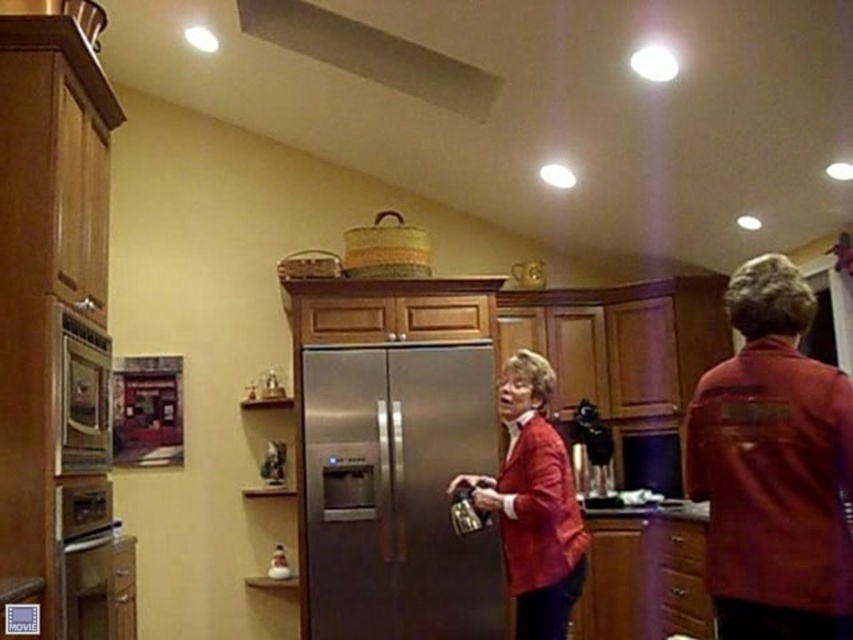
Question: Which is nearer to the matte red blazer at center?

Choices:
 (A) stainless steel oven at left
 (B) matte red jacket at center
 (C) stainless steel refrigerator at center

Answer: (B)

Question: Which of the following is the closest to the observer?

Choices:
 (A) white matte exhaust hood at upper center
 (B) matte red jacket at center

Answer: (B)

Question: Is stainless steel refrigerator at center closer to the viewer compared to white matte exhaust hood at upper center?

Choices:
 (A) no
 (B) yes

Answer: (A)

Question: Is stainless steel refrigerator at center above white matte exhaust hood at upper center?

Choices:
 (A) yes
 (B) no

Answer: (B)

Question: Is stainless steel refrigerator at center thinner than white matte exhaust hood at upper center?

Choices:
 (A) no
 (B) yes

Answer: (B)

Question: Which object is closer to the camera taking this photo?

Choices:
 (A) white matte exhaust hood at upper center
 (B) stainless steel refrigerator at center
 (C) matte red jacket at center
 (D) stainless steel oven at left

Answer: (C)